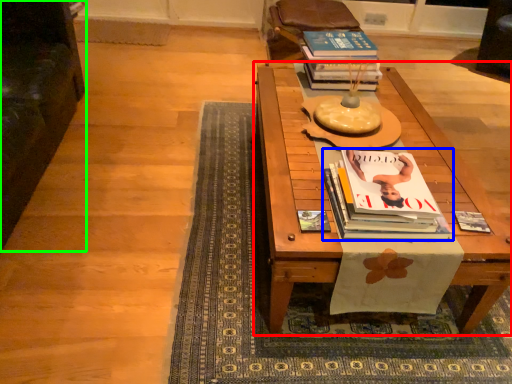
Question: Which is nearer to the table (highlighted by a red box)? book (highlighted by a blue box) or armchair (highlighted by a green box).

Choices:
 (A) book
 (B) armchair

Answer: (A)